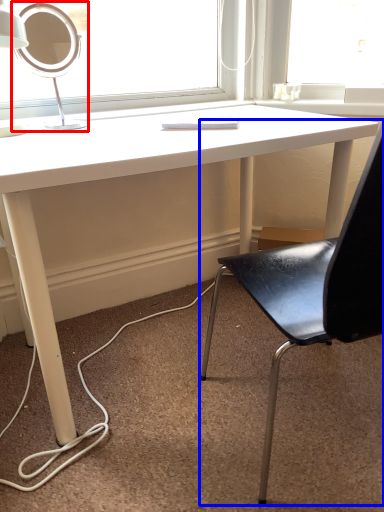
Question: Which object appears farthest to the camera in this image, table lamp (highlighted by a red box) or chair (highlighted by a blue box)?

Choices:
 (A) table lamp
 (B) chair

Answer: (A)